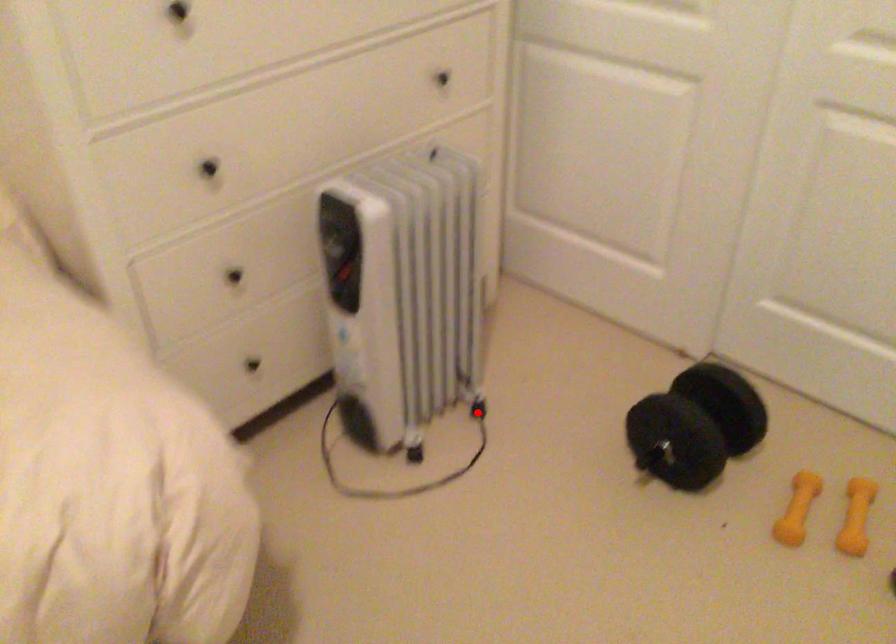
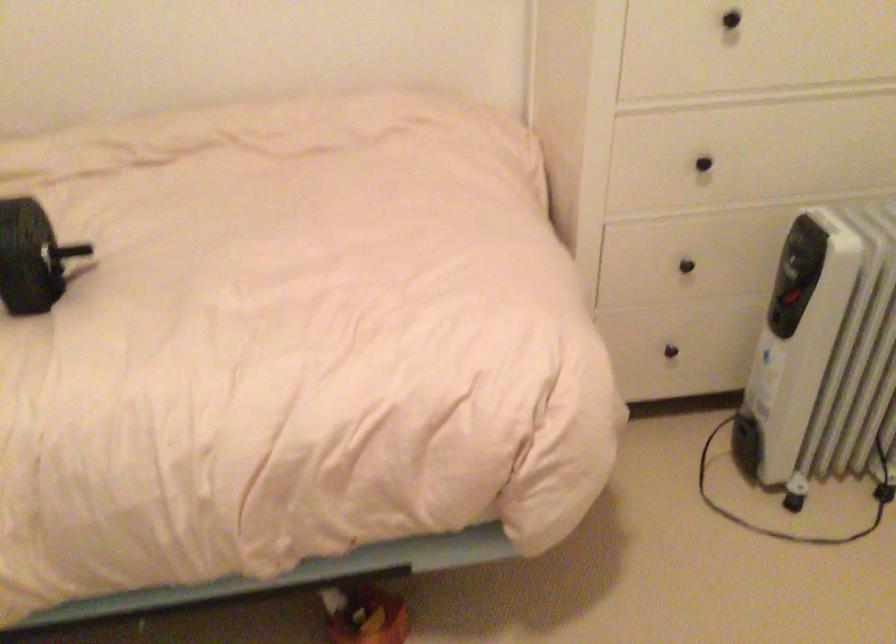
Locate, in the second image, the point that corresponds to the highlighted location in the first image.

(883, 491)